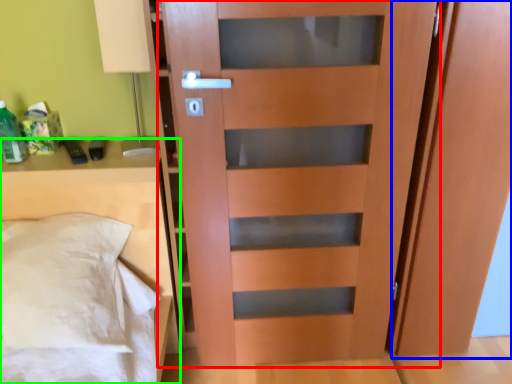
Question: Based on their relative distances, which object is farther from door (highlighted by a red box)? Choose from screen door (highlighted by a blue box) and furniture (highlighted by a green box).

Choices:
 (A) screen door
 (B) furniture

Answer: (B)